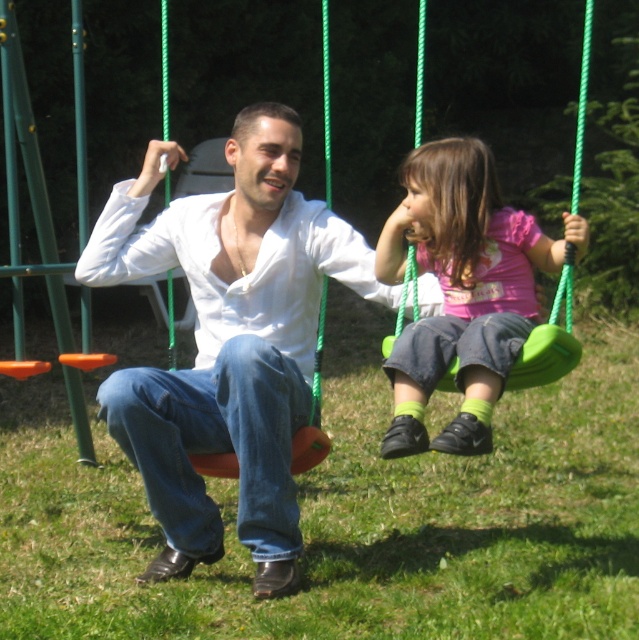
Question: Does pink matte shirt at center appear on the right side of matte orange swing at left?

Choices:
 (A) no
 (B) yes

Answer: (B)

Question: Which of the following is the farthest from the observer?

Choices:
 (A) (424, 308)
 (B) (509, 211)

Answer: (A)

Question: Which point is farther from the camera taking this photo?

Choices:
 (A) (403, 346)
 (B) (166, 38)

Answer: (B)

Question: Does pink matte shirt at center appear over matte orange swing at left?

Choices:
 (A) yes
 (B) no

Answer: (B)

Question: In this image, where is pink matte shirt at center located relative to matte orange swing at left?

Choices:
 (A) left
 (B) right

Answer: (B)

Question: Which of the following is the farthest from the observer?

Choices:
 (A) white matte shirt at center
 (B) matte orange swing at left
 (C) pink matte shirt at center

Answer: (B)